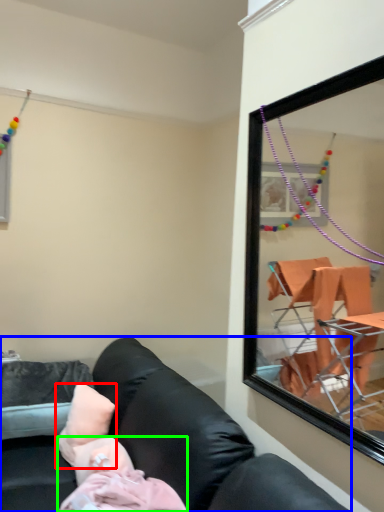
Question: Which object is positioned closest to pillow (highlighted by a red box)? Select from studio couch (highlighted by a blue box) and person (highlighted by a green box).

Choices:
 (A) studio couch
 (B) person

Answer: (B)